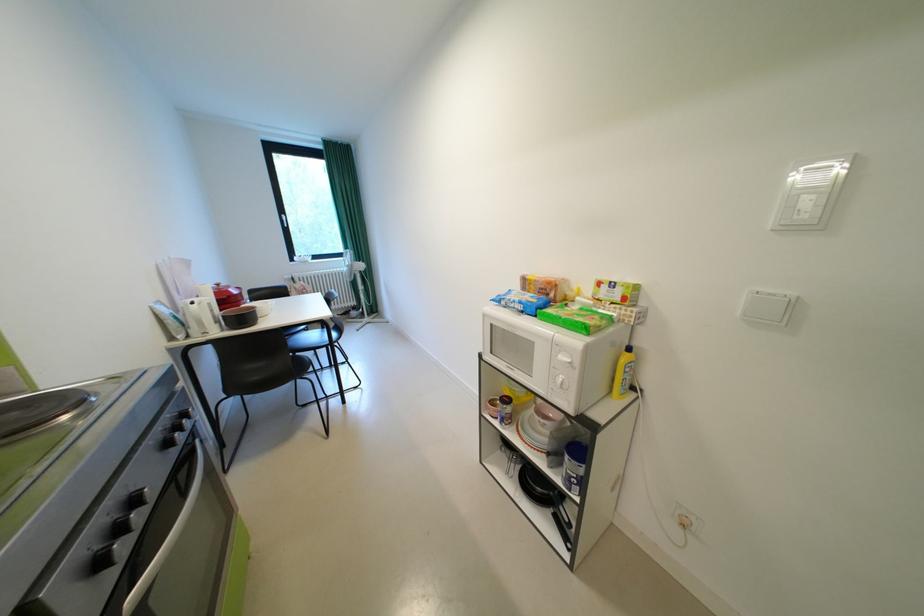
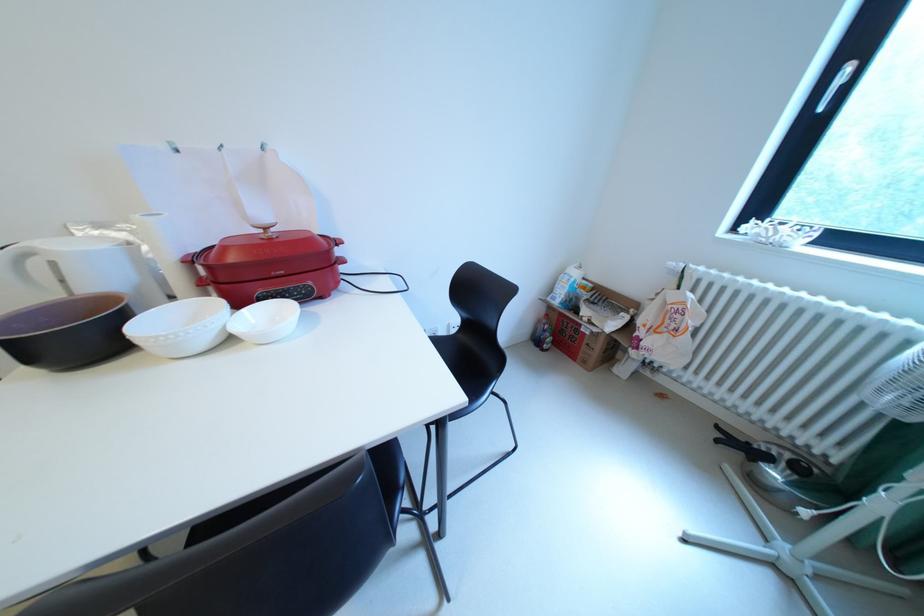
Locate, in the second image, the point that corresponds to point 294,217 in the first image.

(859, 70)